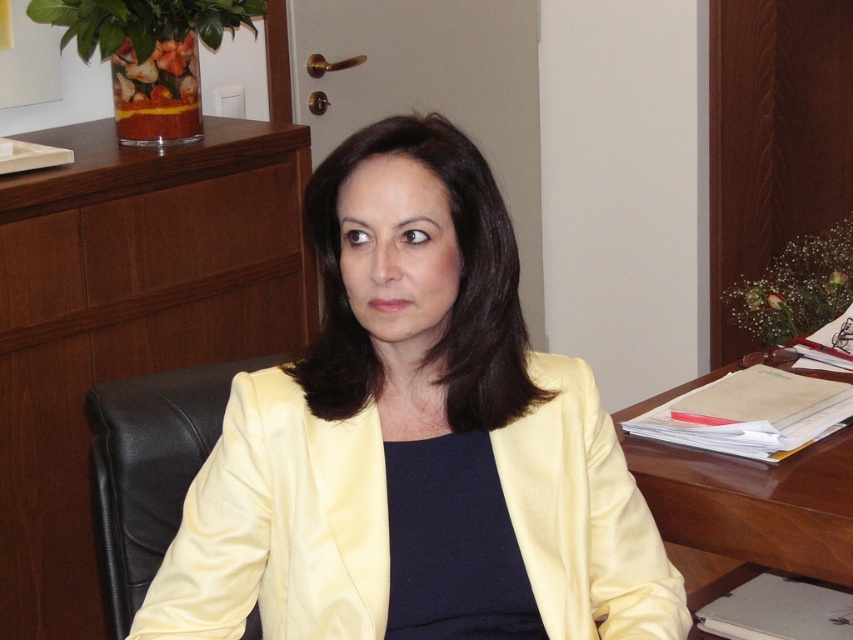
You are an interior designer planning to rearrange the office. You need to know if the satin yellow jacket at center can be placed on the brown wooden table at right without removing any existing items. Based on their sizes, can it fit?

The satin yellow jacket at center occupies less space than brown wooden table at right, so it can fit on the table without removing existing items.

From the picture: You are an office worker who needs to place a new document on the brown wooden table at right. However, the satin yellow jacket at center is currently covering part of the table. Can you place the document on the table without moving the jacket?

The satin yellow jacket at center is positioned over brown wooden table at right, so part of the table is still exposed. You can place the document on the uncovered area of the brown wooden table at right without moving the jacket.

Looking at this image, what are the coordinates of the satin yellow jacket at center?

The coordinates of the satin yellow jacket at center are at point (415,440).